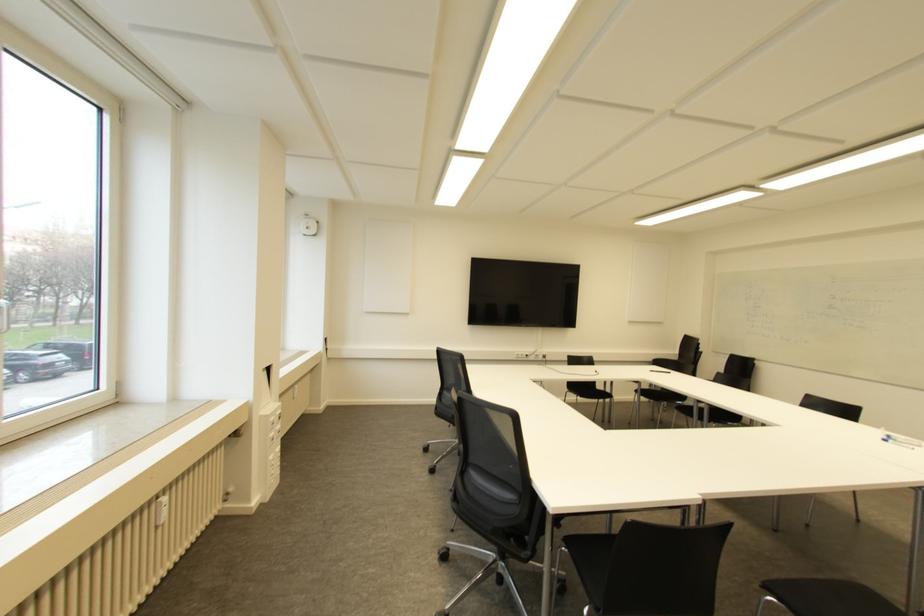
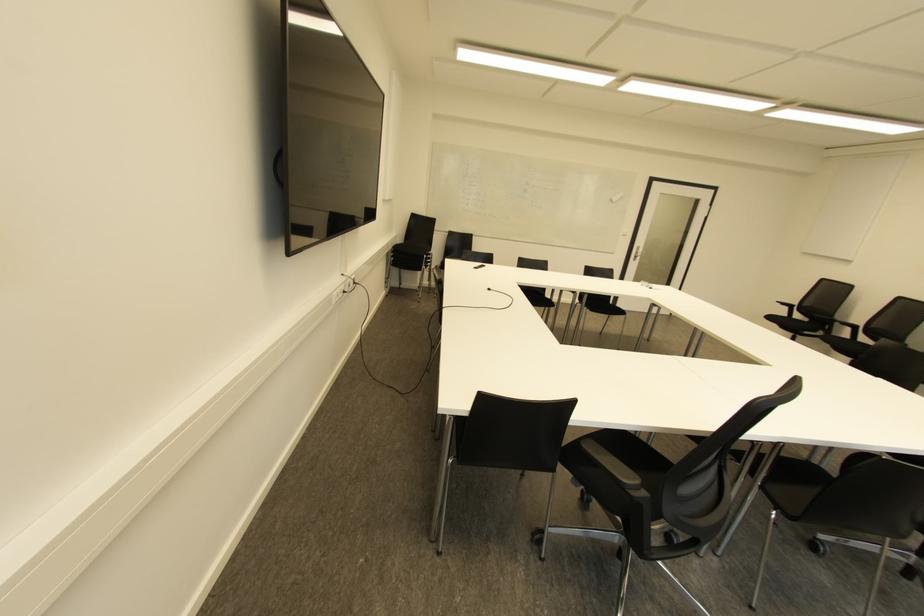
Question: I am providing you with two images of the same scene from different viewpoints. Please identify which objects are invisible in image2.

Choices:
 (A) black remote control
 (B) door handle
 (C) chair sitting surface
 (D) none of these

Answer: (D)